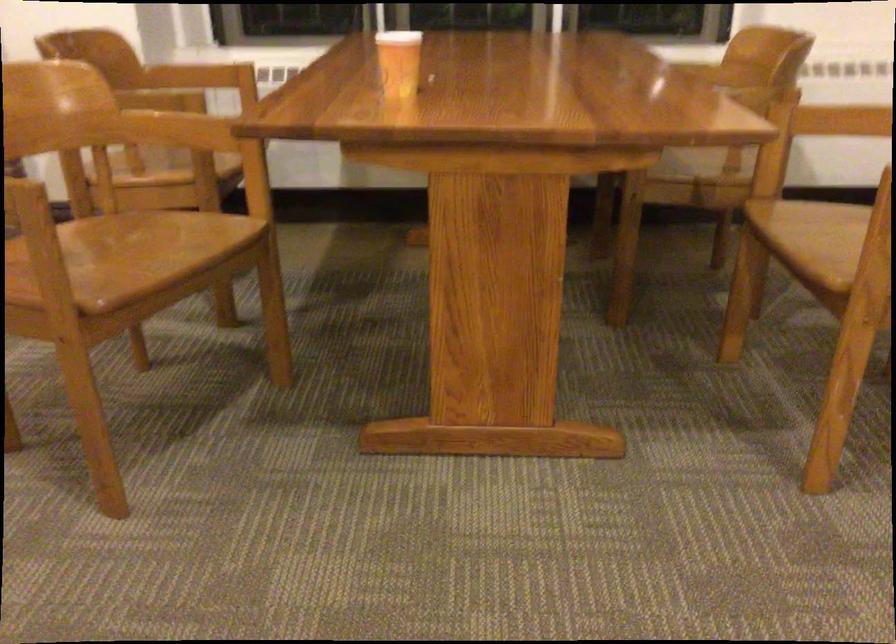
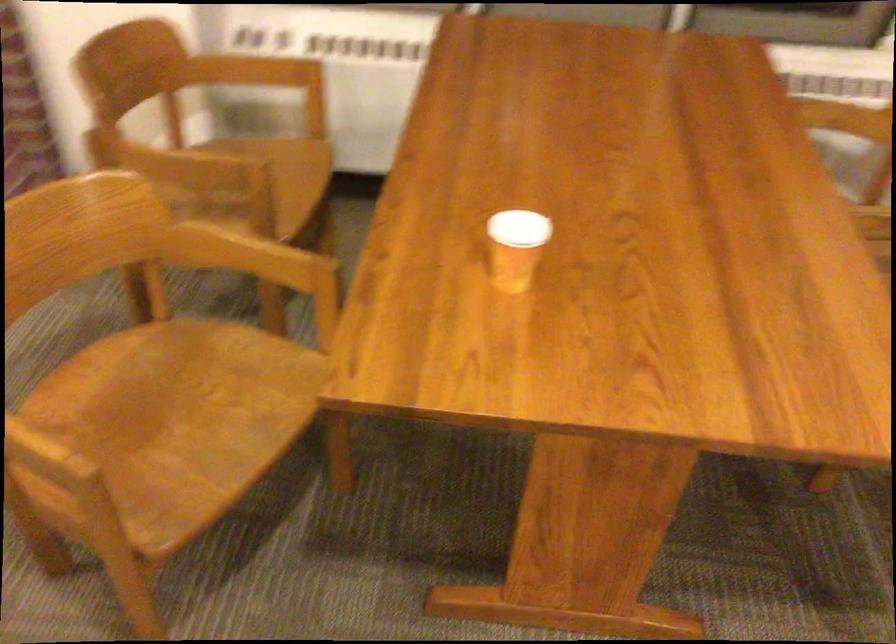
Locate, in the second image, the point that corresponds to [185,137] in the first image.

(248, 257)